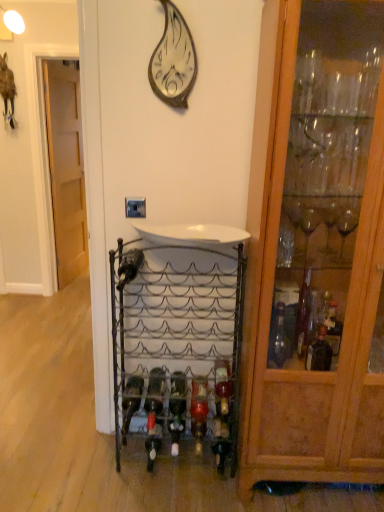
The image size is (384, 512). I want to click on free spot in front of metallic wine rack at center, so click(x=177, y=497).